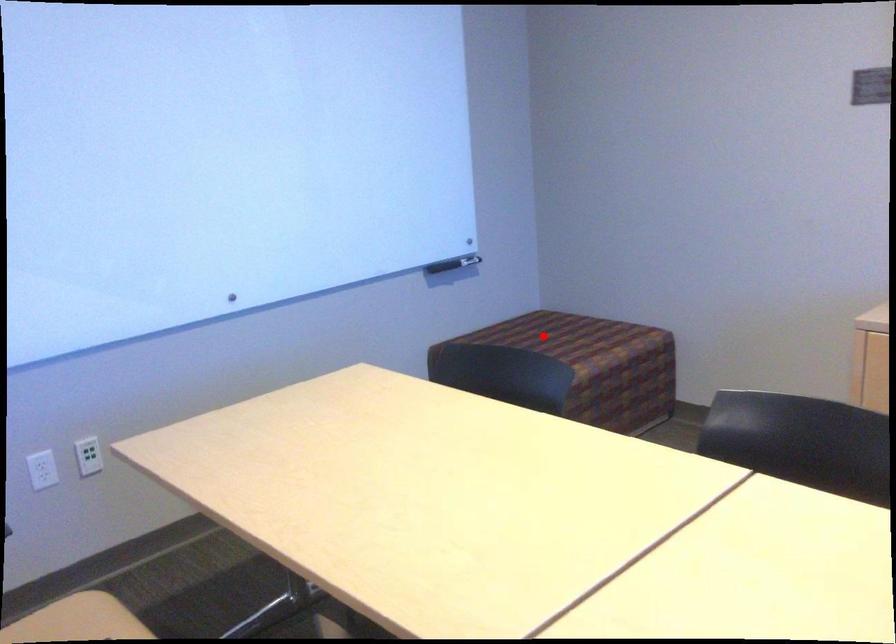
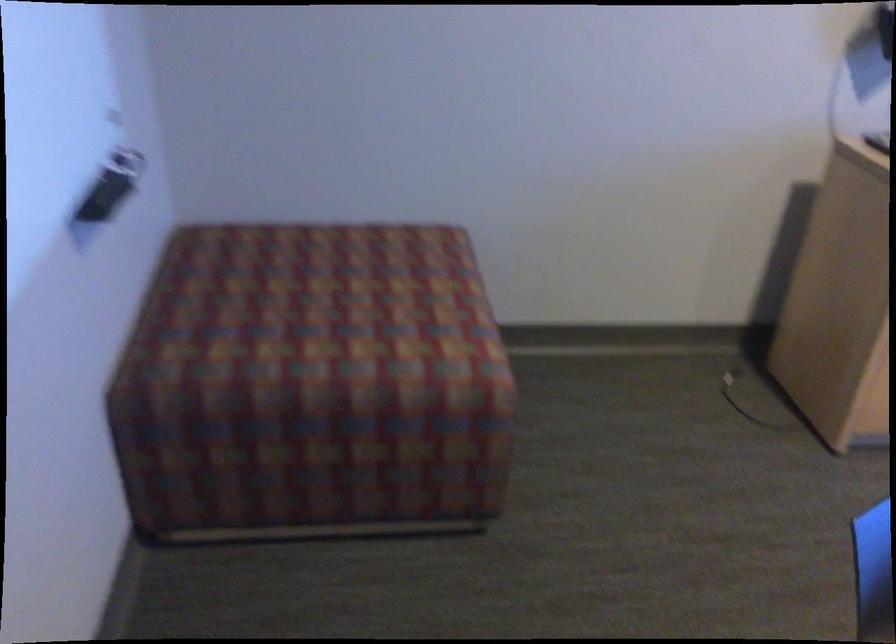
Find the pixel in the second image that matches the highlighted location in the first image.

(332, 301)